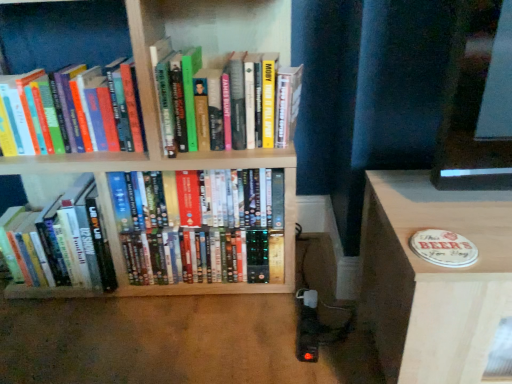
Question: From a real-world perspective, does hardcover book at upper left, the second book positioned from the left, stand above wooden bookshelf at center?

Choices:
 (A) no
 (B) yes

Answer: (B)

Question: Is hardcover book at upper left, the second book positioned from the left, not inside wooden bookshelf at center?

Choices:
 (A) yes
 (B) no

Answer: (B)

Question: Is the depth of hardcover book at upper left, the second book positioned from the left, greater than that of wooden bookshelf at center?

Choices:
 (A) no
 (B) yes

Answer: (B)

Question: Is hardcover book at upper left, the third book in the right-to-left sequence, not near wooden bookshelf at center?

Choices:
 (A) no
 (B) yes

Answer: (A)

Question: Is hardcover book at upper left, the second book positioned from the left, to the right of wooden bookshelf at center from the viewer's perspective?

Choices:
 (A) no
 (B) yes

Answer: (A)

Question: Do you think hardcover book at upper left, the third book in the right-to-left sequence, is within wooden coaster at lower right, or outside of it?

Choices:
 (A) outside
 (B) inside

Answer: (A)

Question: Is hardcover book at upper left, the third book in the right-to-left sequence, wider or thinner than wooden coaster at lower right?

Choices:
 (A) thin
 (B) wide

Answer: (A)

Question: In terms of height, does hardcover book at upper left, the second book positioned from the left, look taller or shorter compared to wooden coaster at lower right?

Choices:
 (A) short
 (B) tall

Answer: (A)

Question: Does point (28, 119) appear closer or farther from the camera than point (439, 196)?

Choices:
 (A) closer
 (B) farther

Answer: (B)

Question: Which is correct: wooden coaster at lower right is inside wooden bookshelf at center, or outside of it?

Choices:
 (A) inside
 (B) outside

Answer: (B)

Question: Considering the relative positions of wooden coaster at lower right and wooden bookshelf at center in the image provided, is wooden coaster at lower right to the left or to the right of wooden bookshelf at center?

Choices:
 (A) left
 (B) right

Answer: (B)

Question: Considering the positions of point (420, 377) and point (219, 14), is point (420, 377) closer or farther from the camera than point (219, 14)?

Choices:
 (A) farther
 (B) closer

Answer: (B)

Question: Relative to wooden bookshelf at center, is wooden coaster at lower right in front or behind?

Choices:
 (A) behind
 (B) front

Answer: (B)

Question: Is wooden bookshelf at center bigger or smaller than hardcover books at center, the 2th book in the right-to-left sequence?

Choices:
 (A) small
 (B) big

Answer: (B)

Question: Would you say wooden bookshelf at center is inside or outside hardcover books at center, arranged as the 3th book when viewed from the left?

Choices:
 (A) inside
 (B) outside

Answer: (B)